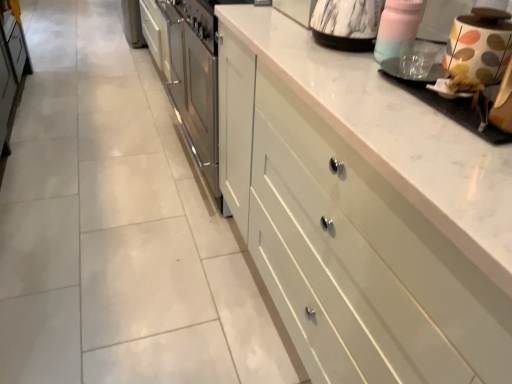
Where is `free space in front of transparent plastic cup at upper right, which is counted as the second appliance, starting from the left`? This screenshot has width=512, height=384. free space in front of transparent plastic cup at upper right, which is counted as the second appliance, starting from the left is located at coordinates (419, 115).